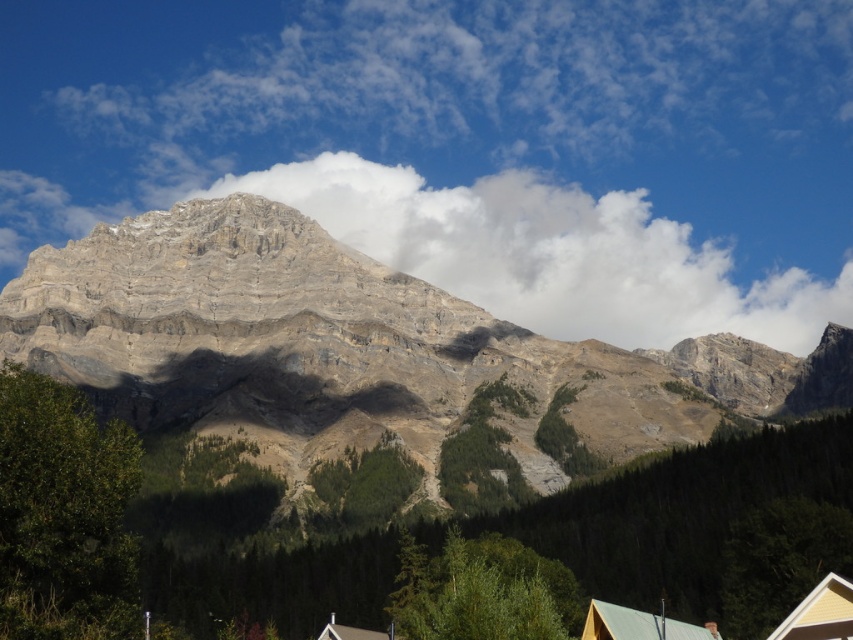
Question: Which point is closer to the camera?

Choices:
 (A) rocky mountain range at center
 (B) white fluffy cloud at upper center
 (C) brown wooden hut at lower center

Answer: (C)

Question: Is rocky mountain range at center smaller than white fluffy cloud at upper center?

Choices:
 (A) no
 (B) yes

Answer: (A)

Question: Which point is closer to the camera?

Choices:
 (A) rocky mountain range at center
 (B) brown wooden hut at lower center
 (C) white fluffy cloud at upper center

Answer: (B)

Question: Which is farther from the rocky mountain range at center?

Choices:
 (A) white fluffy cloud at upper center
 (B) brown wooden hut at lower center

Answer: (B)

Question: Is white fluffy cloud at upper center bigger than brown wooden hut at lower center?

Choices:
 (A) no
 (B) yes

Answer: (B)

Question: Does rocky mountain range at center have a smaller size compared to brown wooden hut at lower center?

Choices:
 (A) no
 (B) yes

Answer: (A)